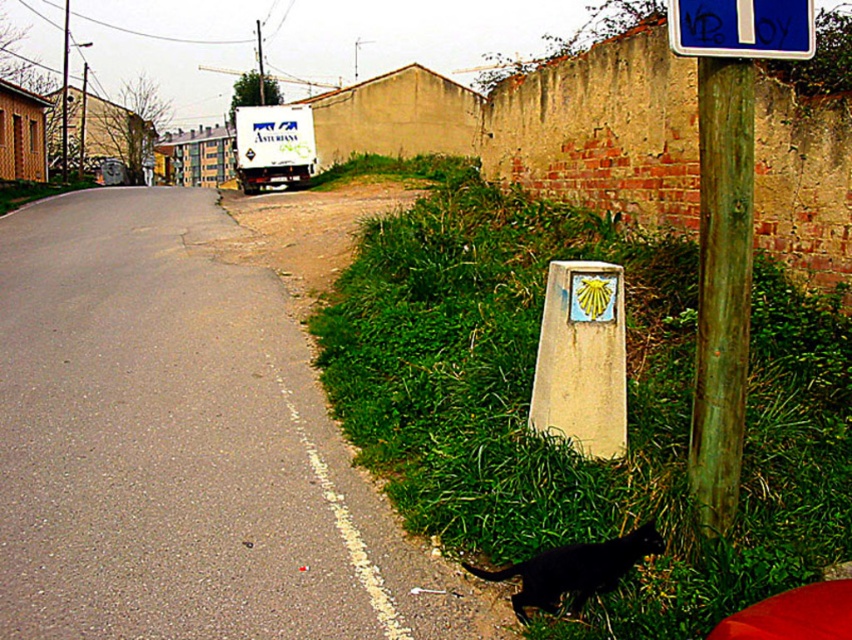
You are a delivery driver who needs to park your truck on the gray asphalt road at lower left. There is a green wood pole at right nearby. Can you park your truck without hitting the pole?

The gray asphalt road at lower left is larger in size than the green wood pole at right, so yes, you can park your truck without hitting the pole since the road has enough space.

You are a delivery person trying to navigate through the urban street scene. You see two points marked on your map at coordinates point [721,477] and point [704,284]. Which point is closer to the residential buildings in the background?

Point [721,477] is behind point [704,284], so it is closer to the residential buildings in the background.